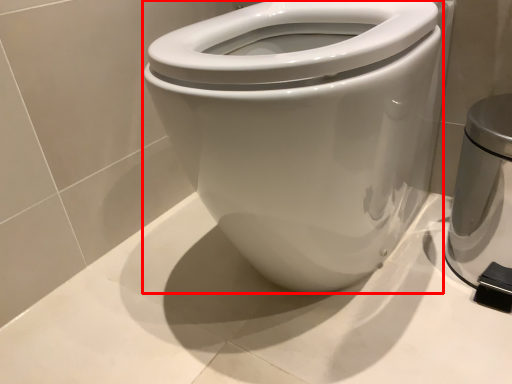
Question: In this image, where is bidet (annotated by the red box) located relative to appliance?

Choices:
 (A) left
 (B) right

Answer: (A)